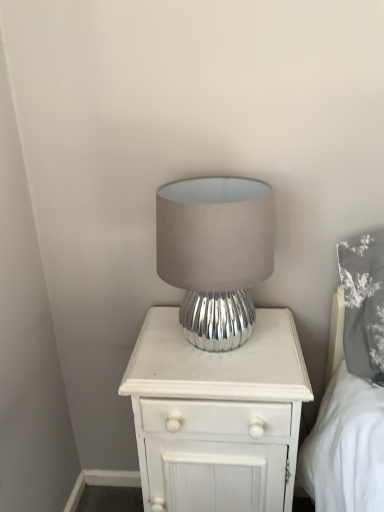
The height and width of the screenshot is (512, 384). I want to click on free point below silver metallic lamp at center (from a real-world perspective), so click(x=219, y=351).